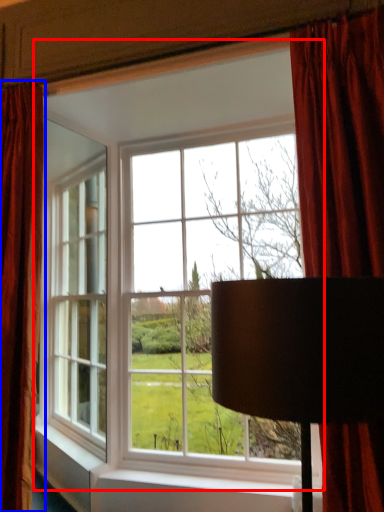
Question: Which object is further to the camera taking this photo, window (highlighted by a red box) or curtain (highlighted by a blue box)?

Choices:
 (A) window
 (B) curtain

Answer: (B)